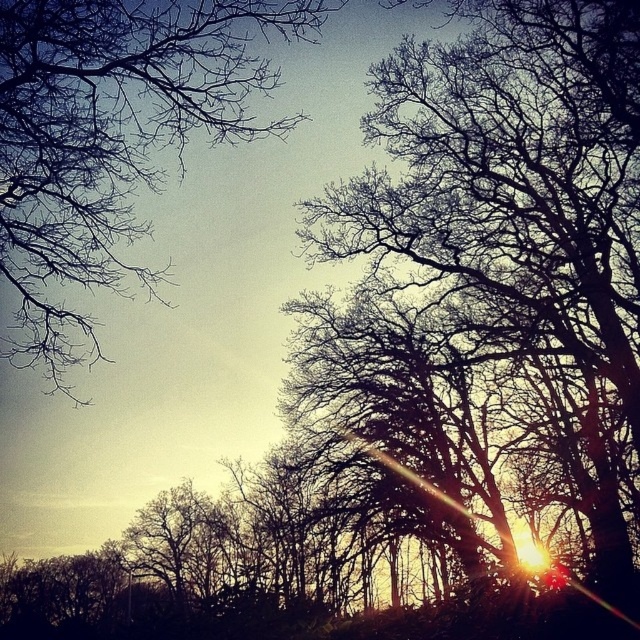
Looking at this image, who is positioned more to the left, silhouette bare branches at center or bare branches at upper left?

bare branches at upper left is more to the left.

Can you confirm if silhouette bare branches at center is taller than bare branches at upper left?

No, silhouette bare branches at center is not taller than bare branches at upper left.

This screenshot has height=640, width=640. What are the coordinates of `silhouette bare branches at center` in the screenshot? It's located at (512, 180).